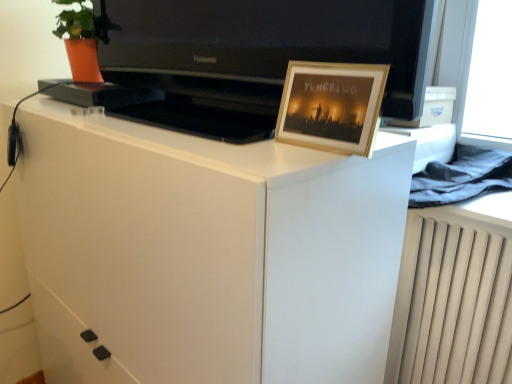
Question: Could you tell me if black glossy television at upper center is facing wooden picture frame at upper right?

Choices:
 (A) no
 (B) yes

Answer: (B)

Question: Is black glossy television at upper center to the right of wooden picture frame at upper right from the viewer's perspective?

Choices:
 (A) yes
 (B) no

Answer: (B)

Question: Would you say wooden picture frame at upper right is part of black glossy television at upper center's contents?

Choices:
 (A) yes
 (B) no

Answer: (A)

Question: Is black glossy television at upper center thinner than wooden picture frame at upper right?

Choices:
 (A) no
 (B) yes

Answer: (A)

Question: From a real-world perspective, is black glossy television at upper center positioned under wooden picture frame at upper right based on gravity?

Choices:
 (A) yes
 (B) no

Answer: (B)

Question: Does black glossy television at upper center have a larger size compared to wooden picture frame at upper right?

Choices:
 (A) yes
 (B) no

Answer: (A)

Question: Does white glossy cabinet at center come in front of wooden picture frame at upper right?

Choices:
 (A) no
 (B) yes

Answer: (B)

Question: Does white glossy cabinet at center lie behind wooden picture frame at upper right?

Choices:
 (A) yes
 (B) no

Answer: (B)

Question: Does white glossy cabinet at center have a smaller size compared to wooden picture frame at upper right?

Choices:
 (A) yes
 (B) no

Answer: (B)

Question: Is white glossy cabinet at center oriented towards wooden picture frame at upper right?

Choices:
 (A) no
 (B) yes

Answer: (A)

Question: Is white glossy cabinet at center in contact with wooden picture frame at upper right?

Choices:
 (A) no
 (B) yes

Answer: (A)

Question: From the image's perspective, is white glossy cabinet at center on wooden picture frame at upper right?

Choices:
 (A) no
 (B) yes

Answer: (A)

Question: From the image's perspective, is black glossy television at upper center located beneath white glossy cabinet at center?

Choices:
 (A) no
 (B) yes

Answer: (A)